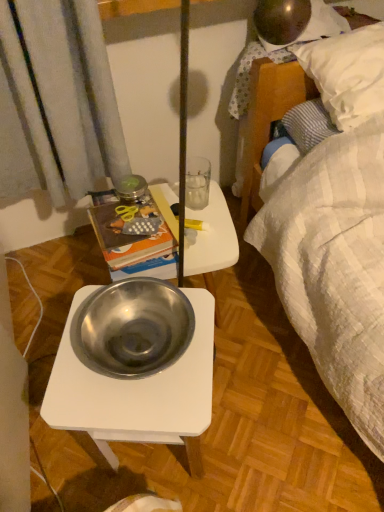
Find the location of `vacant area that is in front of polished stainless steel bowl at center`. vacant area that is in front of polished stainless steel bowl at center is located at coordinates (135, 412).